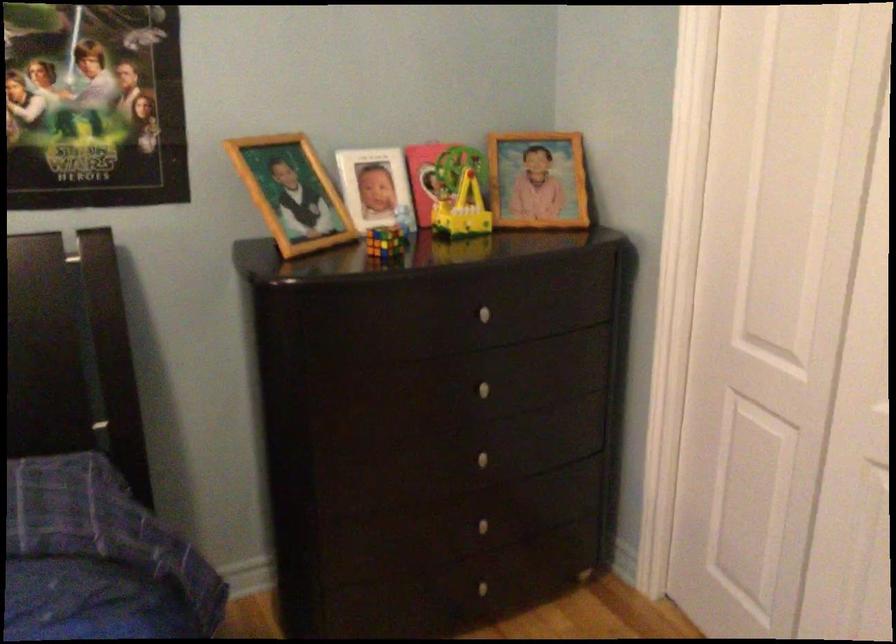
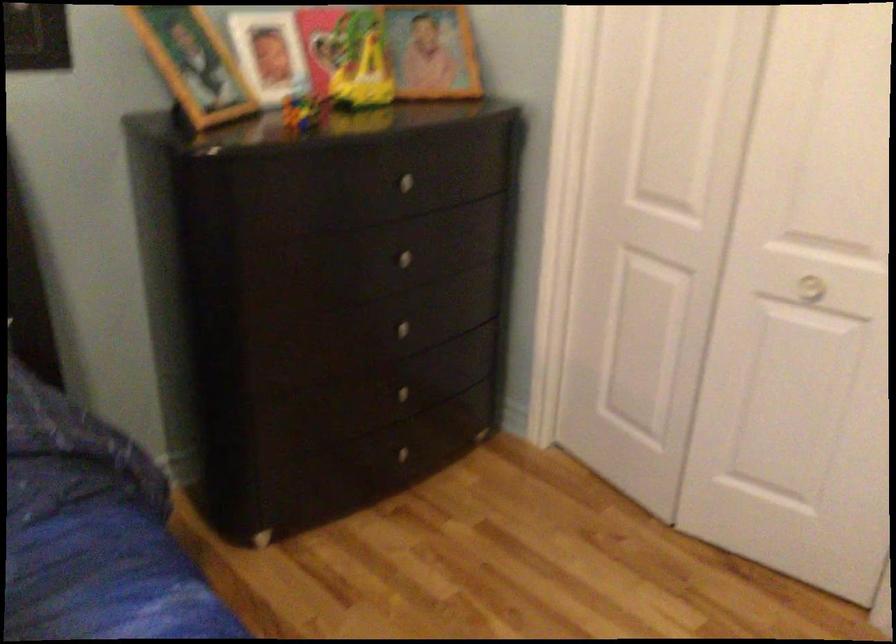
Where in the second image is the point corresponding to [489,462] from the first image?

(409, 332)